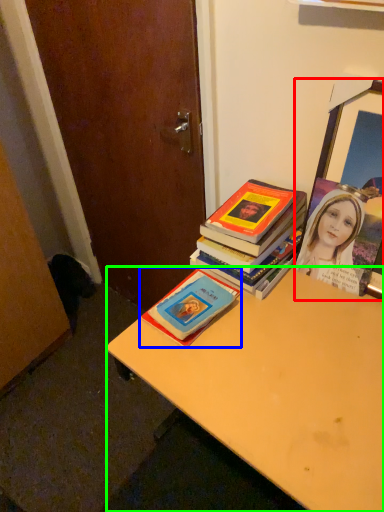
Question: Considering the real-world distances, which object is farthest from picture frame (highlighted by a red box)? book (highlighted by a blue box) or desk (highlighted by a green box)?

Choices:
 (A) book
 (B) desk

Answer: (A)